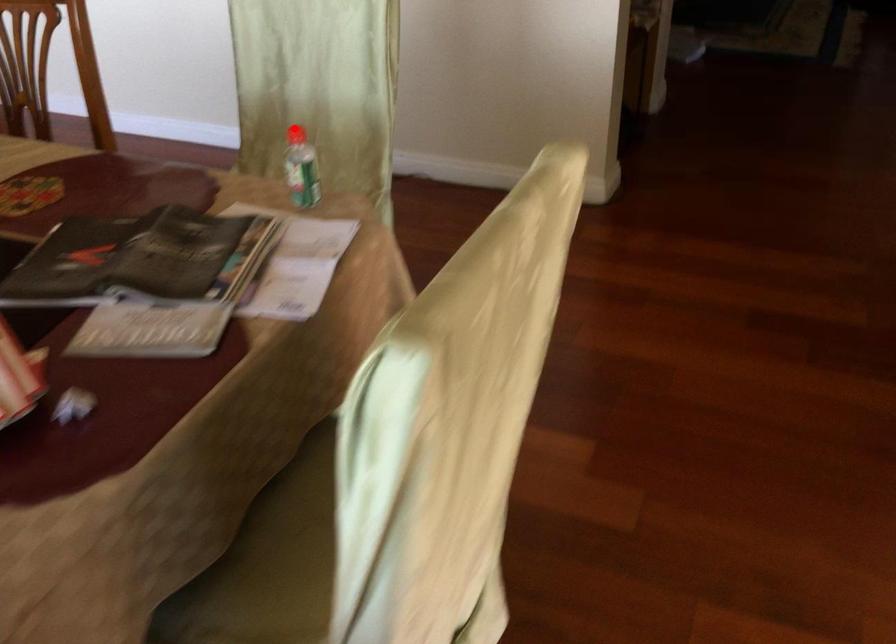
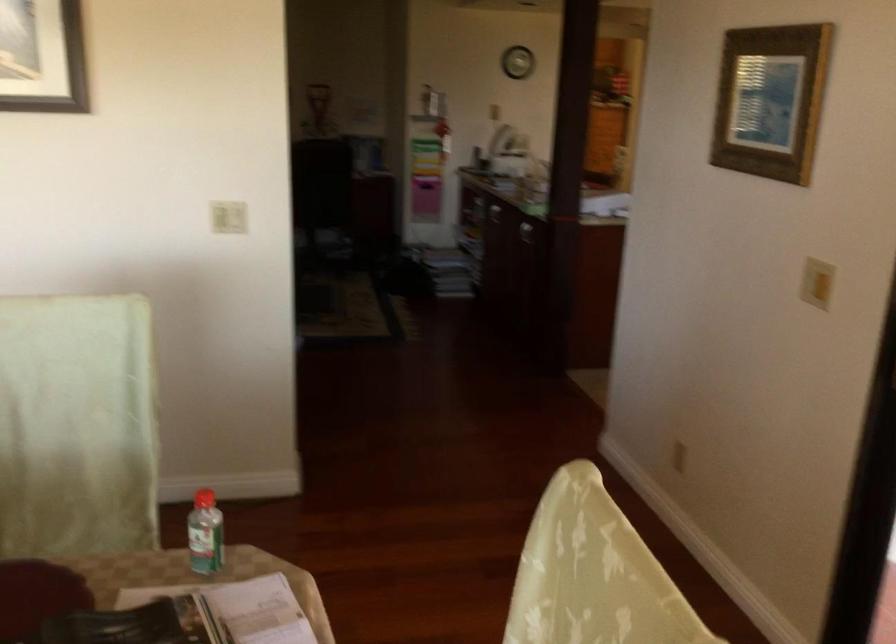
Question: I am providing you with two images of the same scene from different viewpoints. A red point is marked on the first image. At the location where the point appears in image 1, is it still visible in image 2?

Choices:
 (A) Yes
 (B) No

Answer: (A)